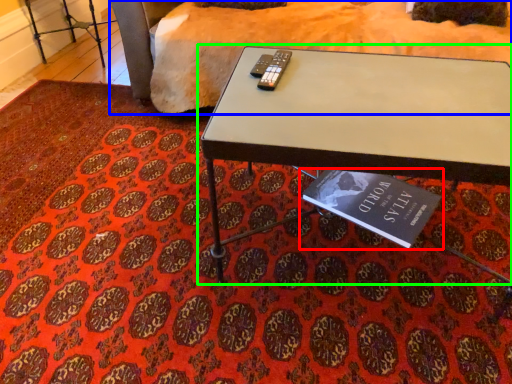
Question: Which object is the farthest from book (highlighted by a red box)? Choose among these: bedding (highlighted by a blue box) or table (highlighted by a green box).

Choices:
 (A) bedding
 (B) table

Answer: (A)